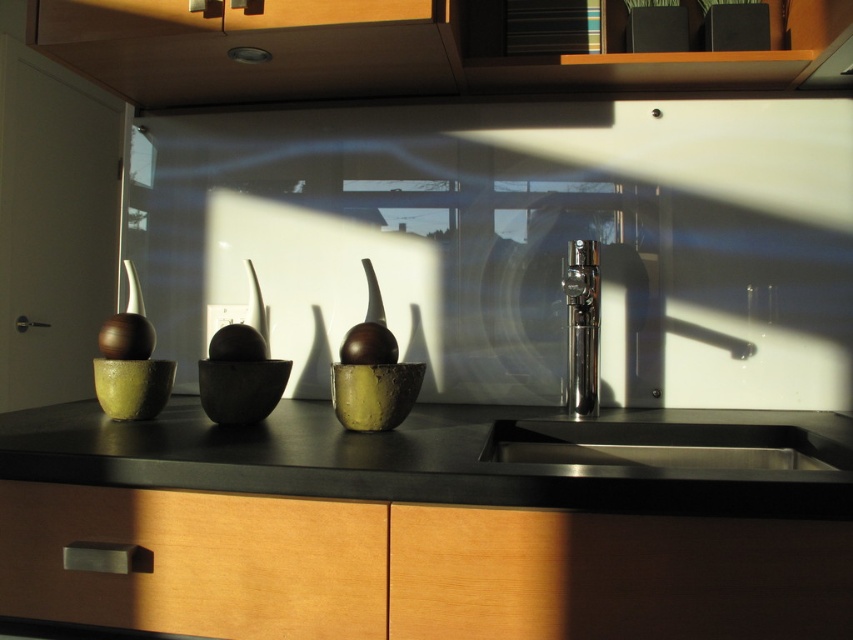
Based on the photo, you are trying to place a large cutting board on the kitchen counter. Given the black matte countertop at center and the stainless steel sink at lower center, which object has enough space to accommodate the board?

The black matte countertop at center is larger in size than the stainless steel sink at lower center, so the black matte countertop at center has enough space to accommodate the board.

You are a kitchen designer planning to install a new faucet. You see the stainless steel sink at center and the stainless steel sink at lower center. Which sink is closer to the front of the kitchen counter?

The stainless steel sink at center is closer to the front of the kitchen counter because it is positioned in front of the stainless steel sink at lower center.

You are a kitchen designer who needs to install a new faucet. The faucet requires a minimum height of 12 inches to function properly. Given the information about the stainless steel sink at center and the stainless steel sink at lower center, which sink can accommodate the faucet?

The stainless steel sink at center is much taller than the stainless steel sink at lower center, so the faucet can be installed on the stainless steel sink at center as it meets the minimum height requirement of 12 inches.